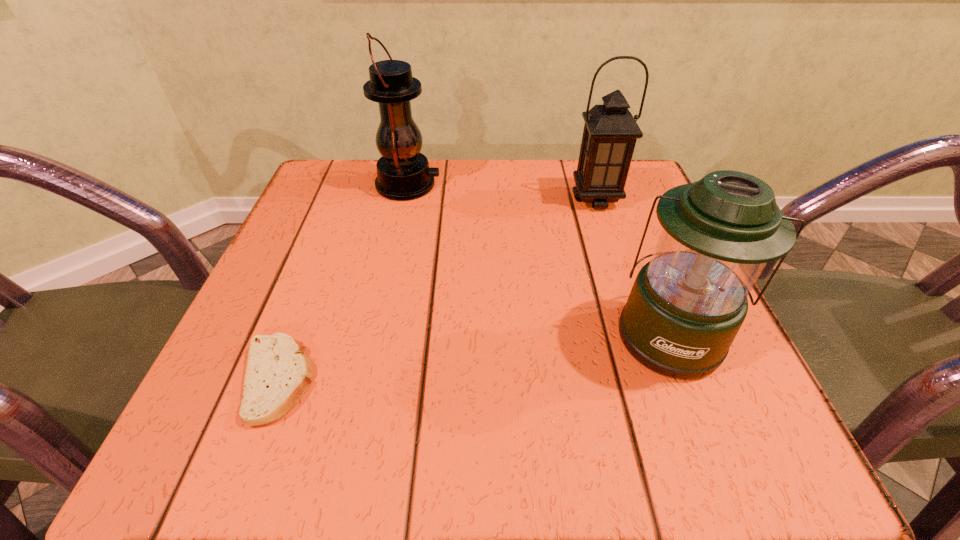
Image resolution: width=960 pixels, height=540 pixels. Identify the location of the leftmost lantern. (403, 173).

Find the location of a particular element. This screenshot has height=540, width=960. the nearest lantern is located at coordinates (687, 304).

Where is `pita bread`? The image size is (960, 540). pita bread is located at coordinates (277, 373).

Where is `the leftmost object`? The height and width of the screenshot is (540, 960). the leftmost object is located at coordinates (277, 373).

Locate several points within the vacant space situated above the leftmost lantern, indicating its light source. Please provide its 2D coordinates. Your answer should be formatted as a tuple, i.e. [(x, y)], where the tuple contains the x and y coordinates of a point satisfying the conditions above.

[(490, 185)]

At what (x,y) coordinates should I click in order to perform the action: click on vacant space located on the back of the nearest lantern. Please return your answer as a coordinate pair (x, y). This screenshot has height=540, width=960. Looking at the image, I should click on (612, 185).

At what (x,y) coordinates should I click in order to perform the action: click on vacant space located on the back of the leftmost object. Please return your answer as a coordinate pair (x, y). Looking at the image, I should click on (306, 305).

Locate an element on the screen. The image size is (960, 540). object that is at the near edge is located at coordinates (277, 373).

Identify the location of lantern that is positioned at the left edge. (403, 173).

Find the location of a particular element. The image size is (960, 540). pita bread that is at the left edge is located at coordinates [277, 373].